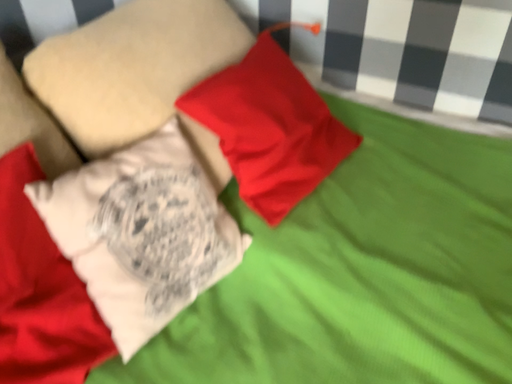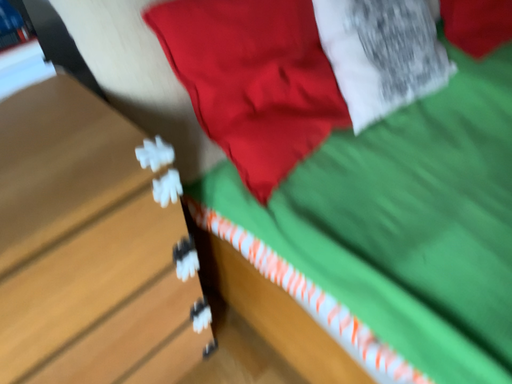
Question: Which way did the camera rotate in the video?

Choices:
 (A) rotated right
 (B) rotated left

Answer: (B)